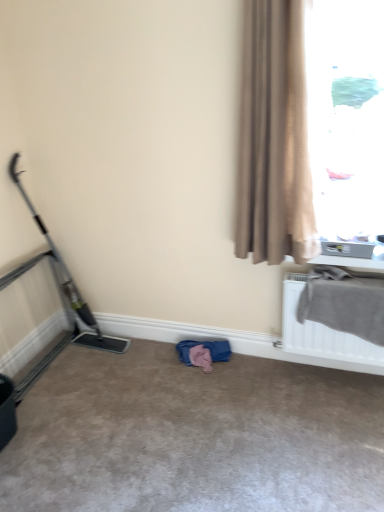
Question: From a real-world perspective, is beige textured curtain at right below metallic gray baby carriage at left?

Choices:
 (A) no
 (B) yes

Answer: (A)

Question: Considering the relative sizes of beige textured curtain at right and metallic gray baby carriage at left in the image provided, is beige textured curtain at right shorter than metallic gray baby carriage at left?

Choices:
 (A) no
 (B) yes

Answer: (A)

Question: Can you confirm if beige textured curtain at right is thinner than metallic gray baby carriage at left?

Choices:
 (A) yes
 (B) no

Answer: (A)

Question: Could you tell me if beige textured curtain at right is facing metallic gray baby carriage at left?

Choices:
 (A) no
 (B) yes

Answer: (A)

Question: Does beige textured curtain at right appear on the left side of metallic gray baby carriage at left?

Choices:
 (A) yes
 (B) no

Answer: (B)

Question: Considering the relative sizes of beige textured curtain at right and metallic gray baby carriage at left in the image provided, is beige textured curtain at right smaller than metallic gray baby carriage at left?

Choices:
 (A) yes
 (B) no

Answer: (A)

Question: Is beige carpet at center oriented away from metallic gray baby carriage at left?

Choices:
 (A) yes
 (B) no

Answer: (B)

Question: Is beige carpet at center taller than metallic gray baby carriage at left?

Choices:
 (A) no
 (B) yes

Answer: (A)

Question: From a real-world perspective, does beige carpet at center sit lower than metallic gray baby carriage at left?

Choices:
 (A) yes
 (B) no

Answer: (A)

Question: Does beige carpet at center come in front of metallic gray baby carriage at left?

Choices:
 (A) yes
 (B) no

Answer: (A)

Question: Is beige carpet at center completely or partially outside of metallic gray baby carriage at left?

Choices:
 (A) no
 (B) yes

Answer: (B)

Question: Is beige carpet at center not close to metallic gray baby carriage at left?

Choices:
 (A) no
 (B) yes

Answer: (A)

Question: From a real-world perspective, does metallic gray baby carriage at left stand above beige textured curtain at right?

Choices:
 (A) yes
 (B) no

Answer: (B)